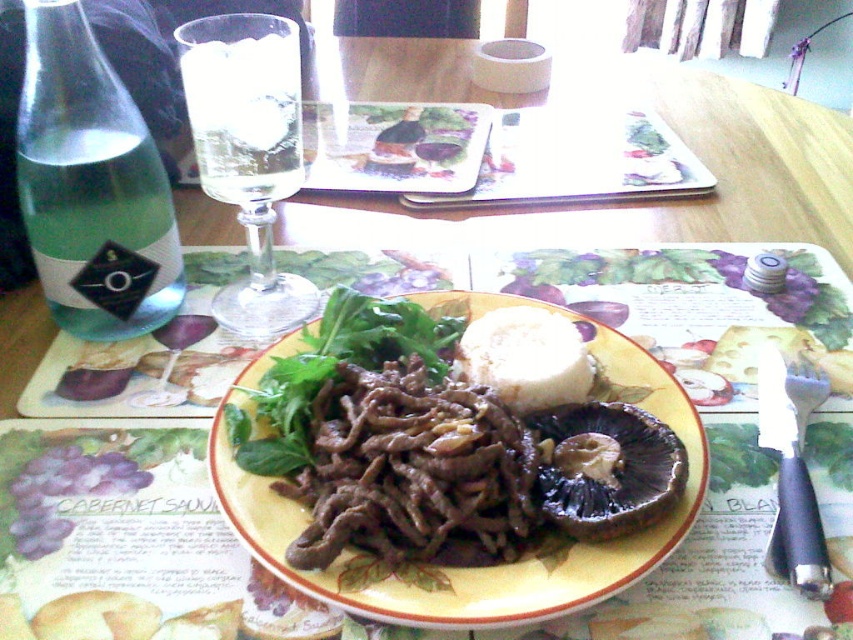
Between silver metallic fork at lower right and white creamy cheese at center, which one has more height?

white creamy cheese at center

Based on the photo, does silver metallic fork at lower right have a larger size compared to white creamy cheese at center?

Yes, silver metallic fork at lower right is bigger than white creamy cheese at center.

Does point (801, 483) come behind point (648, 125)?

No, (801, 483) is closer to viewer.

Locate an element on the screen. silver metallic fork at lower right is located at coordinates (792, 472).

Between brown glossy meat at center and white creamy cheese at center, which one is positioned lower?

Positioned lower is brown glossy meat at center.

Can you confirm if brown glossy meat at center is shorter than white creamy cheese at center?

No, brown glossy meat at center is not shorter than white creamy cheese at center.

Is point (368, 442) less distant than point (657, 122)?

Yes, it is in front of point (657, 122).

Image resolution: width=853 pixels, height=640 pixels. Identify the location of brown glossy meat at center. (459, 472).

Describe the element at coordinates (91, 186) in the screenshot. The width and height of the screenshot is (853, 640). I see `green glass bottle at left` at that location.

From the picture: Between green glass bottle at left and silver metallic fork at lower right, which one has more height?

green glass bottle at left is taller.

Who is more distant from viewer, (113, 256) or (782, 513)?

Positioned behind is point (113, 256).

Where is `green glass bottle at left`? The height and width of the screenshot is (640, 853). green glass bottle at left is located at coordinates (91, 186).